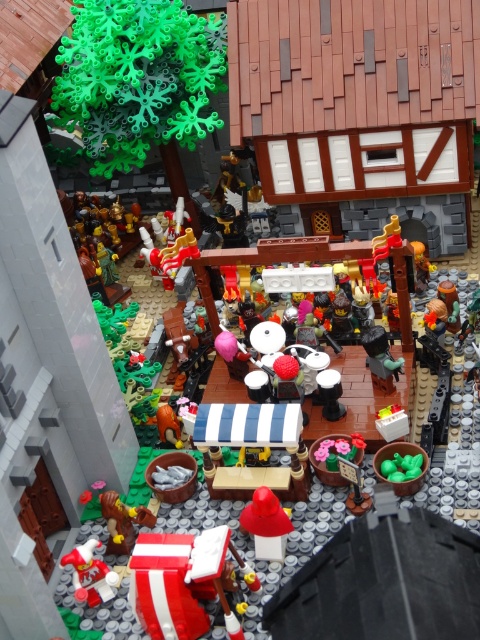
Is point (264, 540) behind point (121, 516)?

No, (264, 540) is in front of (121, 516).

In the scene shown: Does smooth red hat at center appear on the left side of smooth brown wooden axe at lower left?

No, smooth red hat at center is not to the left of smooth brown wooden axe at lower left.

Between point (261, 524) and point (121, 538), which one is positioned behind?

Point (121, 538)

Locate an element on the screen. The height and width of the screenshot is (640, 480). smooth red hat at center is located at coordinates (265, 524).

Is point (88, 568) in front of point (147, 524)?

That is True.

Can you confirm if matte red santa hat at lower left is shorter than smooth brown wooden axe at lower left?

Yes, matte red santa hat at lower left is shorter than smooth brown wooden axe at lower left.

Identify the location of matte red santa hat at lower left. (90, 573).

Who is higher up, smooth red hat at center or matte red santa hat at lower left?

Positioned higher is smooth red hat at center.

Is point (280, 561) positioned before point (95, 600)?

No.

Between point (265, 544) and point (87, 596), which one is positioned in front?

Point (87, 596)

Where is `smooth red hat at center`? The image size is (480, 640). smooth red hat at center is located at coordinates (265, 524).